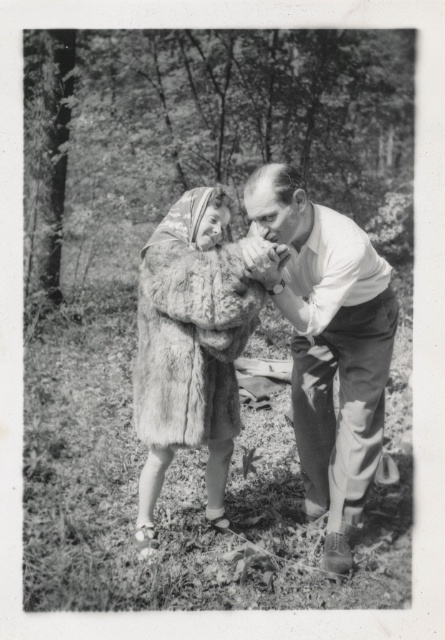
Question: Which of the following is the farthest from the observer?

Choices:
 (A) (357, 312)
 (B) (194, 330)

Answer: (A)

Question: Can you confirm if smooth white shirt at center is smaller than fuzzy fur coat at center?

Choices:
 (A) yes
 (B) no

Answer: (B)

Question: Does smooth white shirt at center come behind fuzzy fur coat at center?

Choices:
 (A) yes
 (B) no

Answer: (B)

Question: Is smooth white shirt at center positioned in front of fuzzy fur coat at center?

Choices:
 (A) no
 (B) yes

Answer: (B)